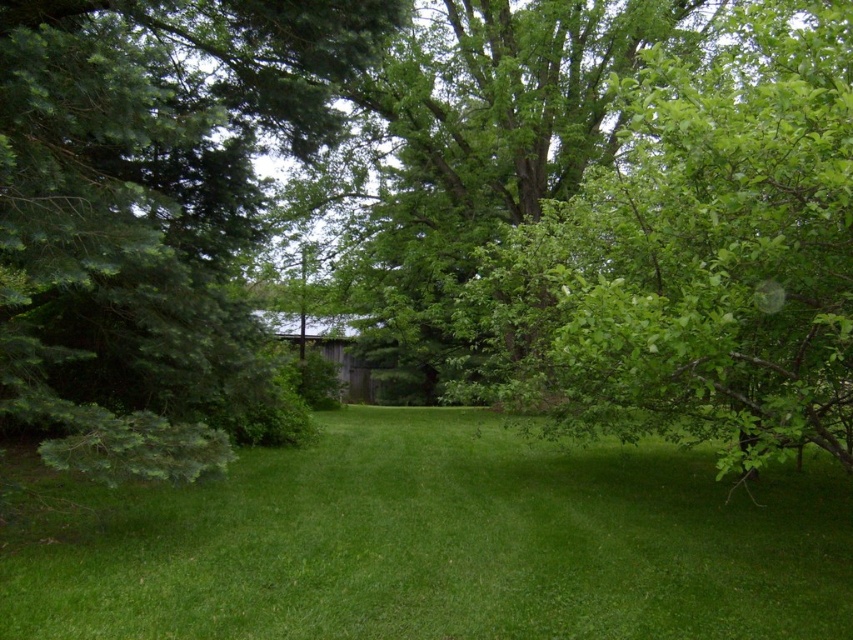
Question: Considering the real-world distances, which object is closest to the green grass at center?

Choices:
 (A) green leafy tree at right
 (B) green leafy tree at left

Answer: (A)

Question: Which of the following is the closest to the observer?

Choices:
 (A) green grass at center
 (B) green leafy tree at left
 (C) green leafy tree at right

Answer: (C)

Question: Where is green grass at center located in relation to green leafy tree at left in the image?

Choices:
 (A) left
 (B) right

Answer: (B)

Question: Which object is the farthest from the green leafy tree at left?

Choices:
 (A) green grass at center
 (B) green leafy tree at right

Answer: (B)

Question: Does green grass at center come behind green leafy tree at left?

Choices:
 (A) yes
 (B) no

Answer: (B)

Question: Is green leafy tree at left closer to the viewer compared to green leafy tree at right?

Choices:
 (A) yes
 (B) no

Answer: (B)